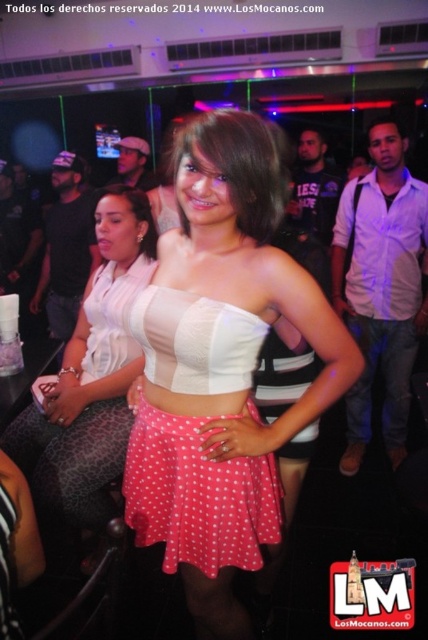
Who is more forward, (228, 131) or (249, 493)?

Positioned in front is point (228, 131).

Is pink polka dot skirt at center below white matte strapless top at center?

Actually, pink polka dot skirt at center is above white matte strapless top at center.

Which is behind, point (142, 381) or point (145, 492)?

The point (142, 381) is more distant.

This screenshot has height=640, width=428. I want to click on pink polka dot skirt at center, so click(x=231, y=387).

Is white matte top at center to the right of jeans at center from the viewer's perspective?

Incorrect, white matte top at center is not on the right side of jeans at center.

Can you confirm if white matte top at center is positioned above jeans at center?

Yes.

Describe the element at coordinates (92, 376) in the screenshot. I see `white matte top at center` at that location.

Identify the location of white matte top at center. (92, 376).

Between white matte strapless top at center and jeans at center, which one is positioned higher?

Positioned higher is jeans at center.

Between white matte strapless top at center and jeans at center, which one has less height?

With less height is white matte strapless top at center.

Measure the distance between point (181, 524) and camera.

Point (181, 524) and camera are 4.05 feet apart.

The height and width of the screenshot is (640, 428). I want to click on white matte strapless top at center, so click(198, 497).